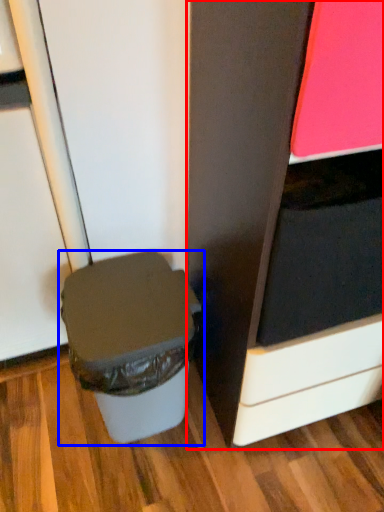
Question: Which of the following is the closest to the observer, cabinetry (highlighted by a red box) or waste container (highlighted by a blue box)?

Choices:
 (A) cabinetry
 (B) waste container

Answer: (A)